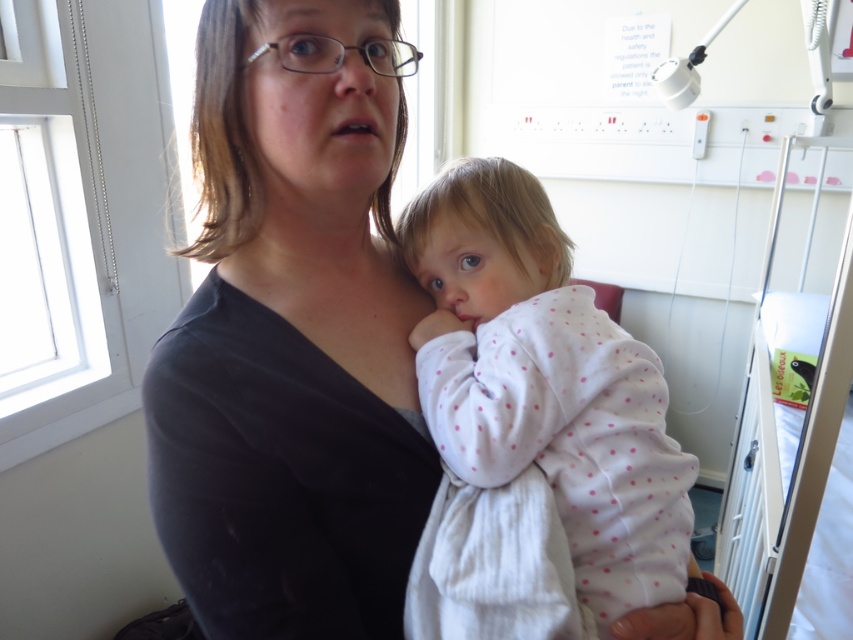
Question: Which point is farther to the camera?

Choices:
 (A) matte black shirt at center
 (B) white polka dot fabric at center

Answer: (B)

Question: From the image, what is the correct spatial relationship of matte black shirt at center in relation to white polka dot fabric at center?

Choices:
 (A) below
 (B) above

Answer: (A)

Question: Which of the following is the closest to the observer?

Choices:
 (A) white polka dot fabric at center
 (B) matte black shirt at center

Answer: (B)

Question: Can you confirm if matte black shirt at center is thinner than white polka dot fabric at center?

Choices:
 (A) yes
 (B) no

Answer: (B)

Question: Can you confirm if matte black shirt at center is positioned above white polka dot fabric at center?

Choices:
 (A) yes
 (B) no

Answer: (B)